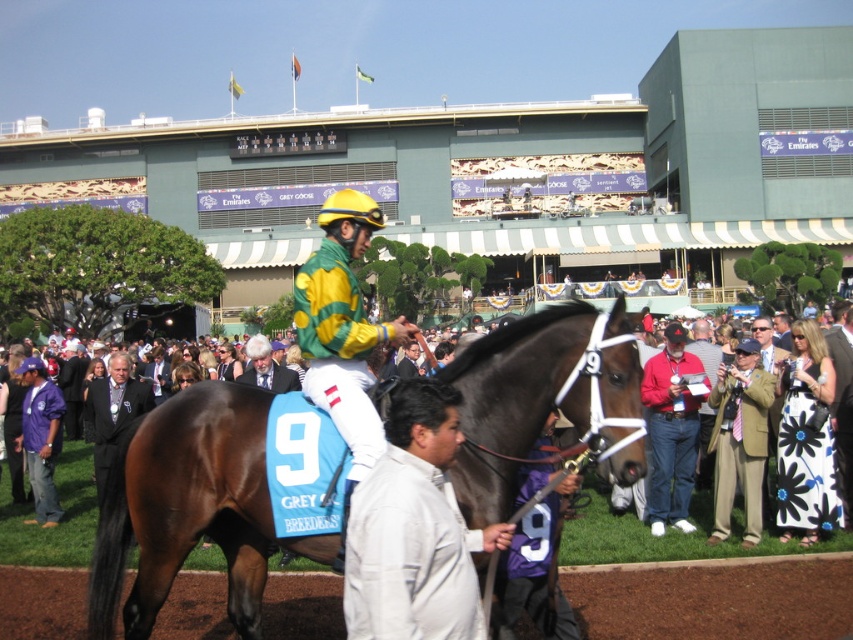
Question: Does purple fabric jacket at lower left appear on the left side of dark suit at center?

Choices:
 (A) yes
 (B) no

Answer: (A)

Question: Which is farther from the red cotton shirt at center?

Choices:
 (A) white matte jacket at center
 (B) brown glossy horse at center
 (C) gray wool suit at center
 (D) purple fabric jacket at lower left

Answer: (D)

Question: Does brown glossy horse at center have a lesser width compared to yellow-green jersey at center?

Choices:
 (A) yes
 (B) no

Answer: (B)

Question: Does brown glossy horse at center have a smaller size compared to khaki fabric suit at center?

Choices:
 (A) yes
 (B) no

Answer: (B)

Question: Which object is the closest to the gray wool suit at center?

Choices:
 (A) brown dirt track at lower center
 (B) purple fabric jacket at lower left

Answer: (B)

Question: Among these objects, which one is nearest to the camera?

Choices:
 (A) purple fabric jacket at lower left
 (B) brown glossy horse at center

Answer: (B)